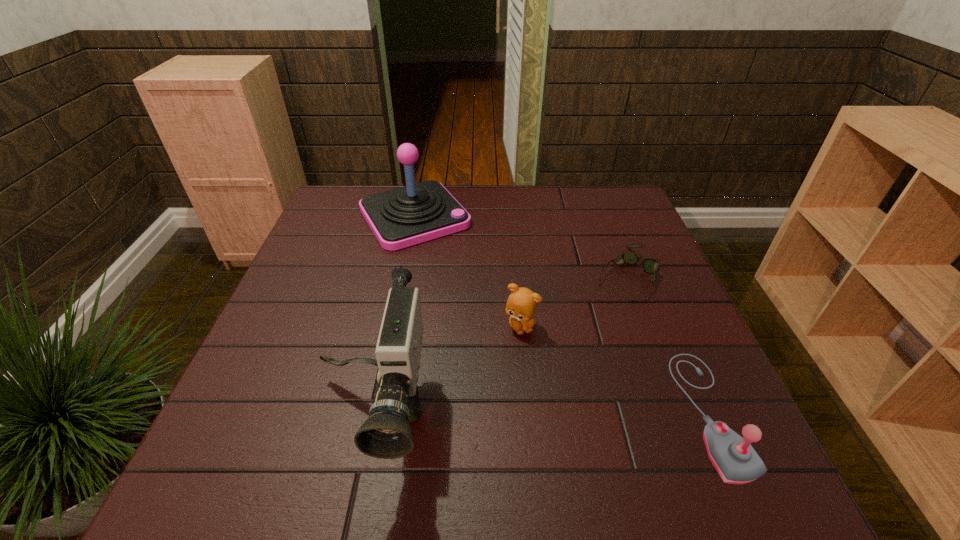
Locate an element on the screen. The height and width of the screenshot is (540, 960). camcorder is located at coordinates (386, 434).

Where is `the shorter joystick`? The width and height of the screenshot is (960, 540). the shorter joystick is located at coordinates (733, 457).

I want to click on the nearer joystick, so click(733, 457).

This screenshot has height=540, width=960. What are the coordinates of `the left joystick` in the screenshot? It's located at (402, 217).

Image resolution: width=960 pixels, height=540 pixels. Identify the location of the farther joystick. (402, 217).

What are the coordinates of `teddy bear` in the screenshot? It's located at tap(521, 305).

At what (x,y) coordinates should I click in order to perform the action: click on the third object from right to left. Please return your answer as a coordinate pair (x, y). Image resolution: width=960 pixels, height=540 pixels. Looking at the image, I should click on (521, 305).

You are a GUI agent. You are given a task and a screenshot of the screen. Output one action in this format:
    pyautogui.click(x=<x>, y=<y>)
    Task: Click on the second farthest object
    This screenshot has width=960, height=540.
    Given the screenshot: What is the action you would take?
    pyautogui.click(x=650, y=265)

In order to click on the shortest object in this screenshot , I will do `click(650, 265)`.

Locate an element on the screen. The width and height of the screenshot is (960, 540). free spot located 0.050m on the left of the right joystick is located at coordinates (660, 413).